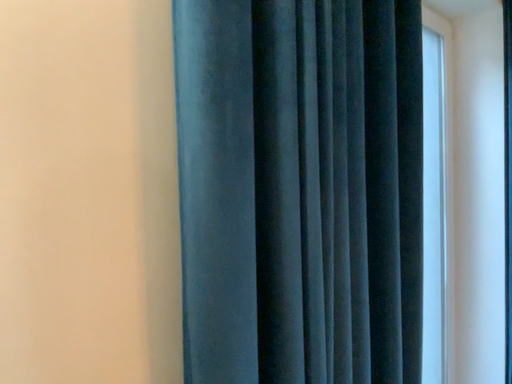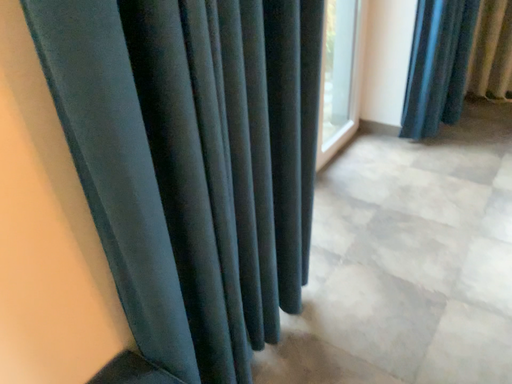
Question: How did the camera likely rotate when shooting the video?

Choices:
 (A) rotated left
 (B) rotated right

Answer: (B)